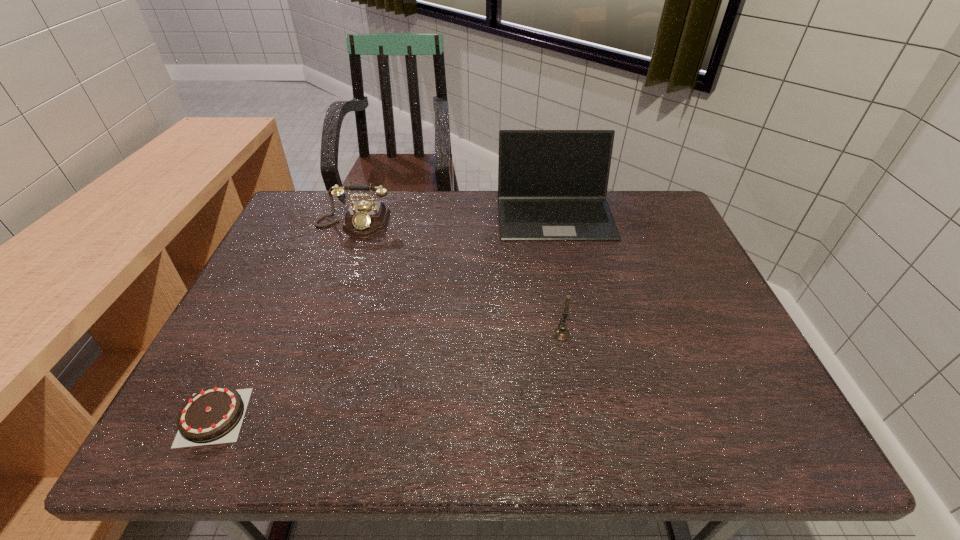
Locate an element on the screen. The width and height of the screenshot is (960, 540). vacant point at the far left corner is located at coordinates (336, 202).

Where is `vacant space at the far right corner of the desktop`? vacant space at the far right corner of the desktop is located at coordinates (617, 205).

This screenshot has height=540, width=960. I want to click on vacant point located between the telephone and the tallest object, so click(454, 219).

Identify the location of free space between the telephone and the nearest object. Image resolution: width=960 pixels, height=540 pixels. (283, 321).

Find the location of a particular element. The width and height of the screenshot is (960, 540). free point between the telephone and the candle is located at coordinates coord(457,280).

Identify the location of free area in between the third farthest object and the laptop. Image resolution: width=960 pixels, height=540 pixels. (558, 274).

Where is `vacant area that lies between the telephone and the nearest object`? vacant area that lies between the telephone and the nearest object is located at coordinates (283, 321).

You are a GUI agent. You are given a task and a screenshot of the screen. Output one action in this format:
    pyautogui.click(x=<x>, y=<y>)
    Task: Click on the free space between the telephone and the tallest object
    
    Given the screenshot: What is the action you would take?
    pyautogui.click(x=454, y=219)

At what (x,y) coordinates should I click in order to perform the action: click on free space between the chocolate cake and the tallest object. Please return your answer as a coordinate pair (x, y). The image size is (960, 540). Looking at the image, I should click on (384, 315).

The image size is (960, 540). Identify the location of free space between the third farthest object and the nearest object. (388, 376).